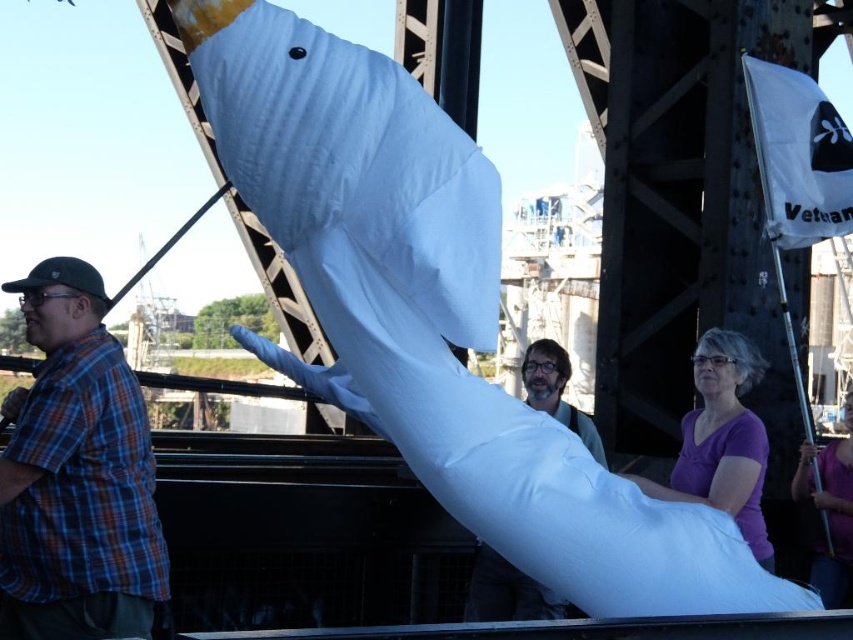
You are a photographer standing at the base of the large metal bridge. You notice the matte white pillow at center and the purple matte shirt at lower right in your viewfinder. Which object appears taller in the photo?

The matte white pillow at center appears taller than the purple matte shirt at lower right in the photo.

You are standing on the bridge and see the plaid shirt at left and the matte white pillow at center. Which object is closer to the edge of the bridge?

The plaid shirt at left is closer to the edge of the bridge because it is positioned to the left of the matte white pillow at center, and the edge of the bridge is on the left side.